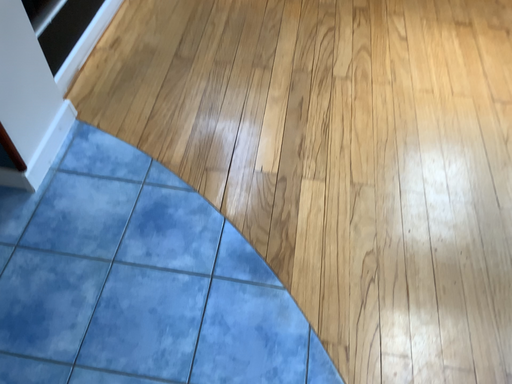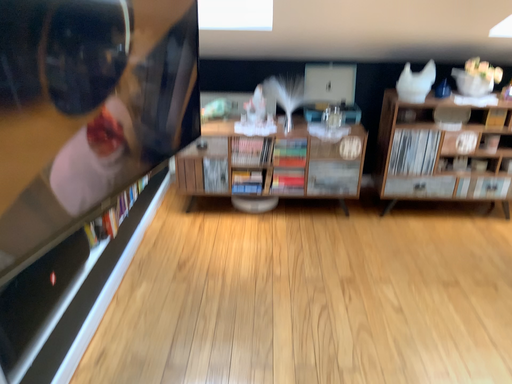
Question: Which way did the camera rotate in the video?

Choices:
 (A) rotated upward
 (B) rotated downward

Answer: (A)